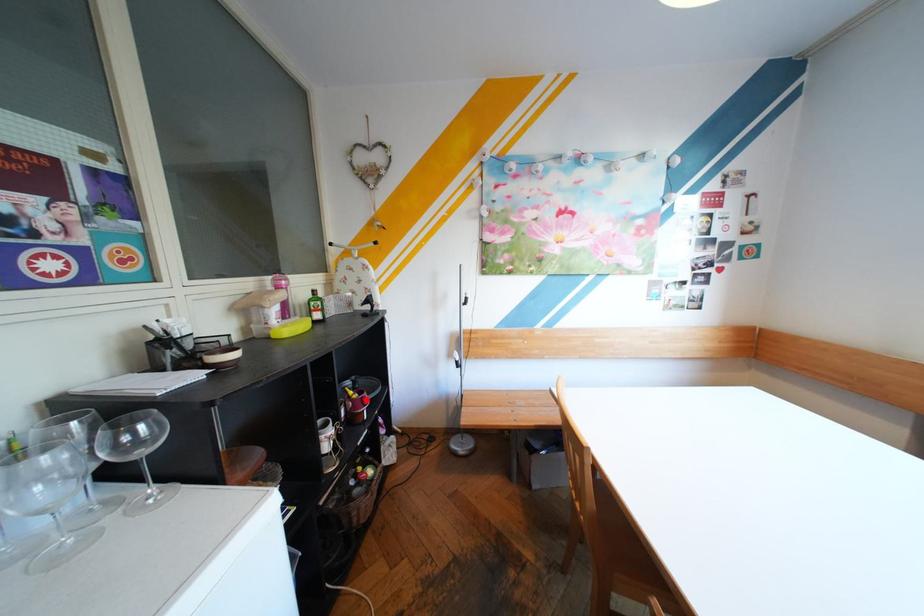
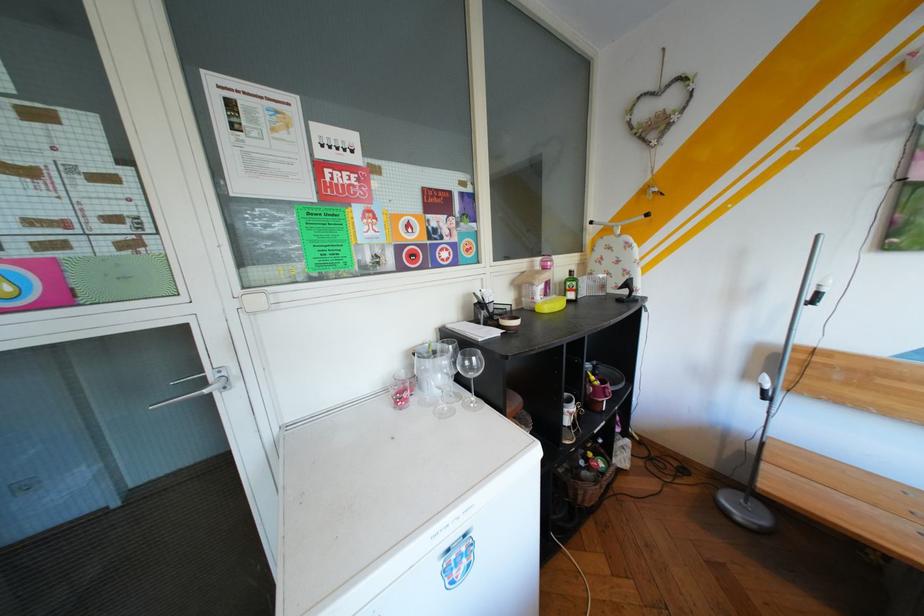
Find the pixel in the second image that matches the highlighted location in the first image.

(608, 386)